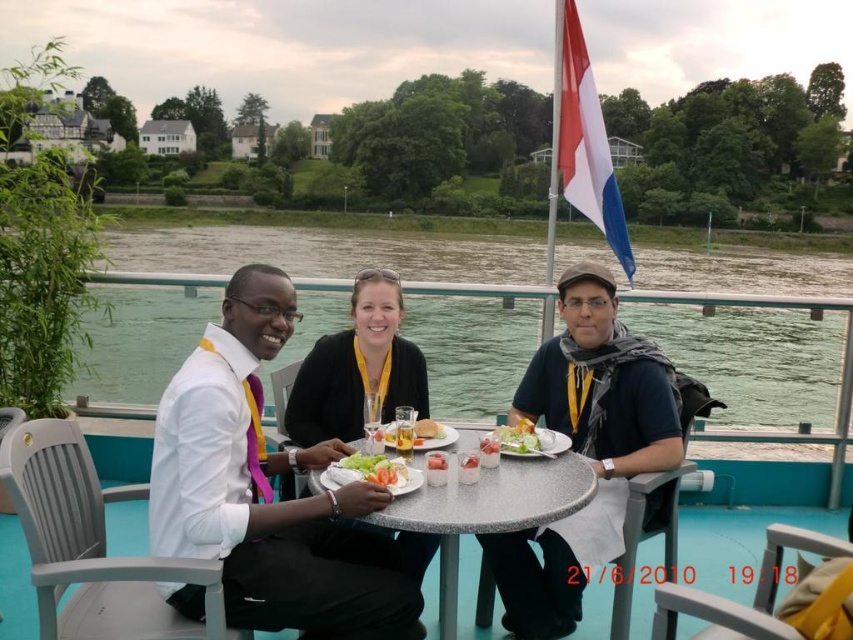
From the picture: Does translucent glass plate at center come in front of translucent plastic cup at center?

No, it is behind translucent plastic cup at center.

Which is behind, point (427, 444) or point (433, 460)?

The point (427, 444) is more distant.

Locate an element on the screen. This screenshot has width=853, height=640. translucent glass plate at center is located at coordinates (431, 435).

Does greenish-blue water at center appear under white glossy plate at center?

Actually, greenish-blue water at center is above white glossy plate at center.

Can you confirm if greenish-blue water at center is bigger than white glossy plate at center?

Correct, greenish-blue water at center is larger in size than white glossy plate at center.

Which is in front, point (108, 390) or point (393, 470)?

Positioned in front is point (393, 470).

What are the coordinates of `greenish-blue water at center` in the screenshot? It's located at (403, 285).

Is matte black sweater at center bigger than translucent glass plate at center?

Yes, matte black sweater at center is bigger than translucent glass plate at center.

Can you confirm if matte black sweater at center is positioned below translucent glass plate at center?

Actually, matte black sweater at center is above translucent glass plate at center.

Find the location of a particular element. The width and height of the screenshot is (853, 640). matte black sweater at center is located at coordinates (358, 368).

Find the location of a particular element. The image size is (853, 640). matte black sweater at center is located at coordinates (358, 368).